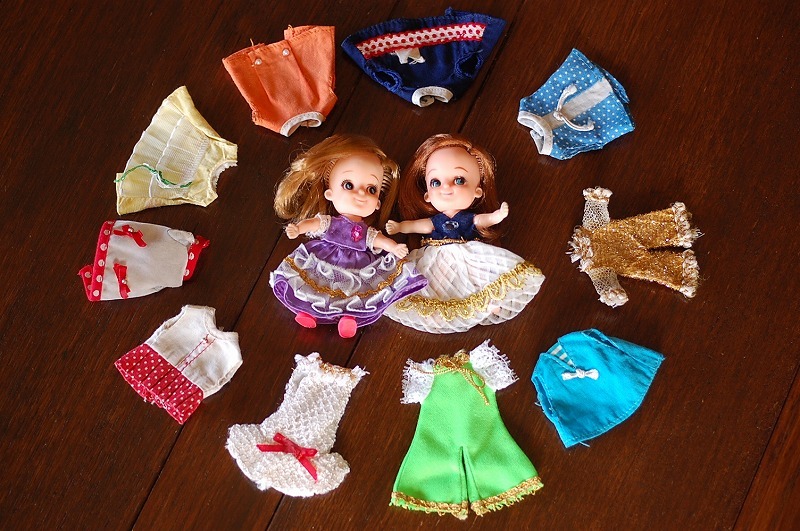
Locate an element on the screen. This screenshot has width=800, height=531. eyes on dolls is located at coordinates (348, 183), (370, 188), (434, 179), (460, 177).